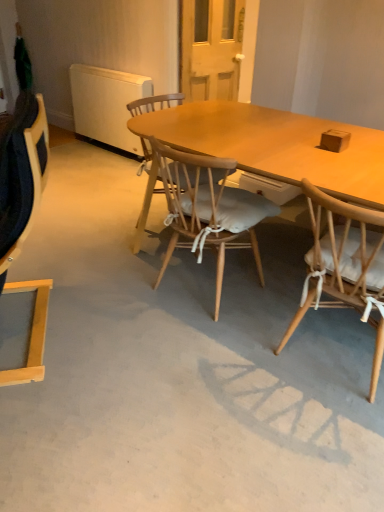
You are a GUI agent. You are given a task and a screenshot of the screen. Output one action in this format:
    pyautogui.click(x=<x>, y=<y>)
    Task: Click on the vacant region under white matte radiator at upper left (from a real-world perspective)
    
    Given the screenshot: What is the action you would take?
    pyautogui.click(x=114, y=150)